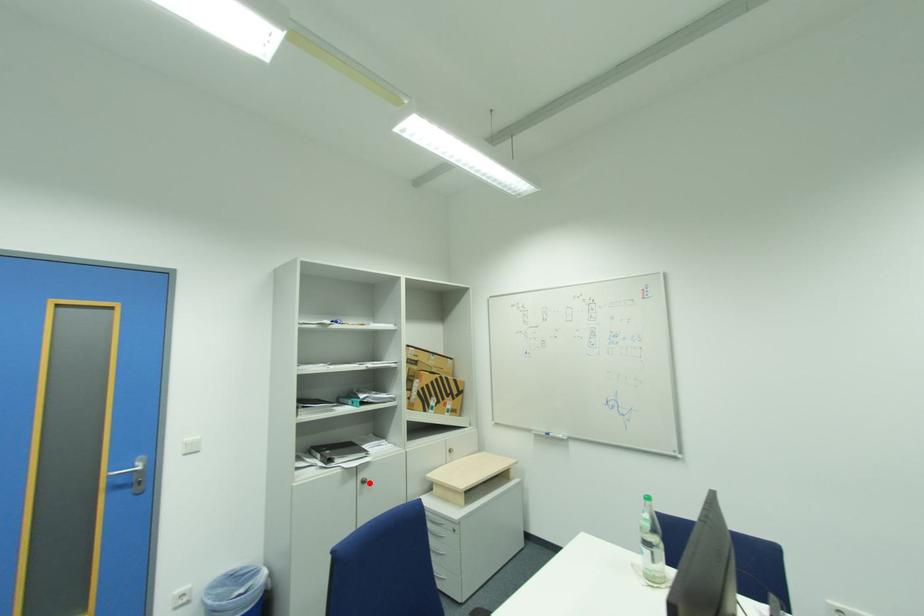
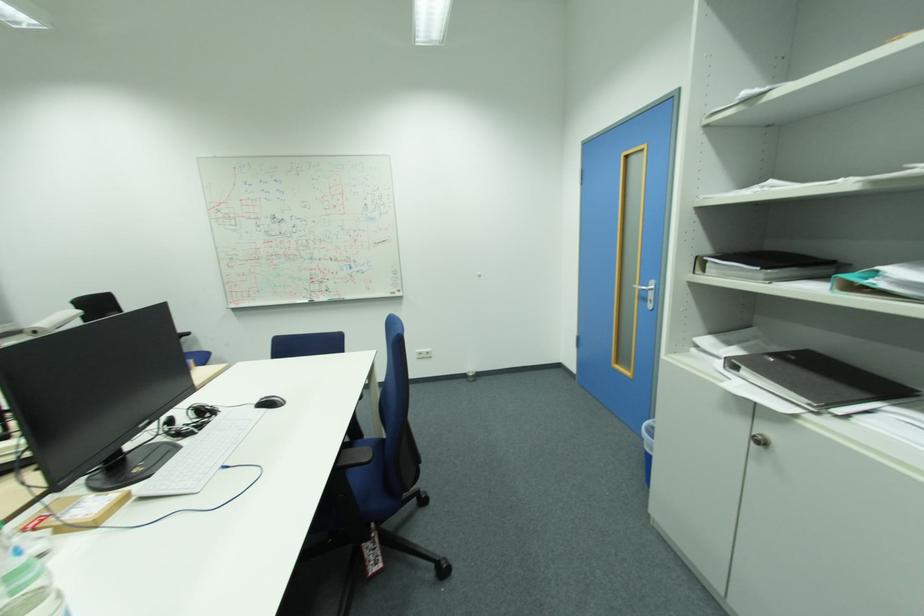
Locate, in the second image, the point that corresponds to the highlighted location in the first image.

(766, 443)